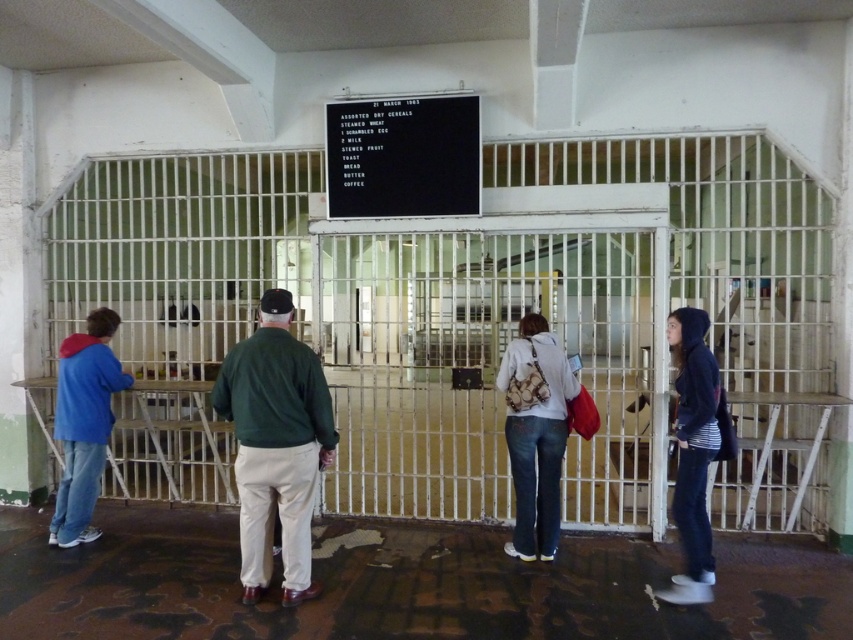
You are a tour guide in the historical prison. You need to point out the black matte signboard at center to your visitors. However, the dark blue hoodie at right is blocking the view. Can you tell the visitors which object is taller?

The dark blue hoodie at right is taller than the black matte signboard at center.

You are standing in the historical prison cell block and want to take a photo of both the point at coordinates (61, 490) and the point at coordinates (697, 349). Which point should you focus on first to ensure both are in clear view?

You should focus on the point at coordinates (61, 490) first because it is closer to you than the point at coordinates (697, 349), ensuring both points remain in clear view.

You are a tour guide leading a group through this historical prison. You need to move from the black matte signboard at center to the dark blue hoodie at right to answer a visitor question. Can you walk directly between them without needing to move any objects?

The distance between the black matte signboard at center and the dark blue hoodie at right is 1.98 meters, so yes, you can walk directly between them without needing to move any objects since the space is sufficient for movement.